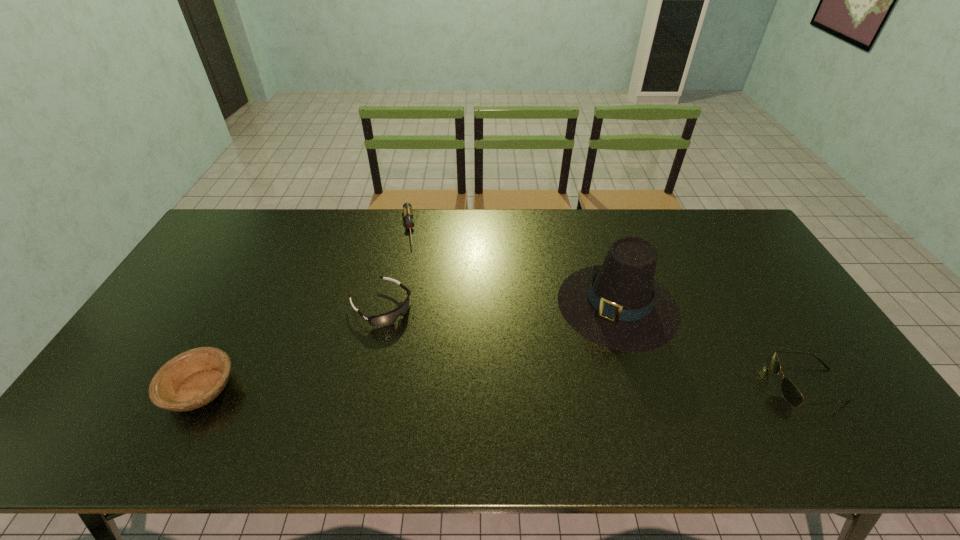
Find the location of a particular element. Image resolution: width=960 pixels, height=540 pixels. free space on the desktop that is between the leftmost object and the sunglasses and is positioned on the front and sides of the goggles is located at coordinates (479, 388).

The height and width of the screenshot is (540, 960). In order to click on free space on the desktop that is between the bowl and the rightmost object and is positioned insert the shortest object into a screw head in this screenshot , I will do `click(428, 388)`.

Where is `vacant spot on the desktop that is between the leftmost object and the rightmost object and is positioned on the front-facing side of the tallest object`? vacant spot on the desktop that is between the leftmost object and the rightmost object and is positioned on the front-facing side of the tallest object is located at coordinates (543, 387).